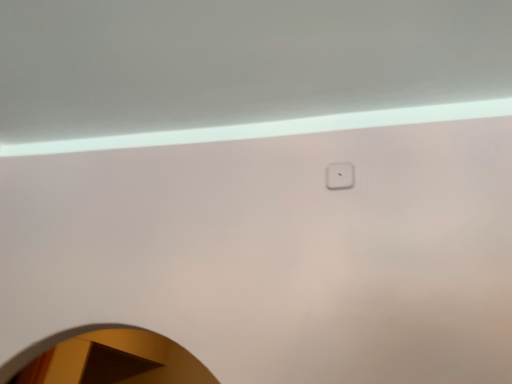
Question: From the image's perspective, is white glossy mirror at lower left located above or below white plastic light switch at upper center?

Choices:
 (A) below
 (B) above

Answer: (A)

Question: Considering the relative positions of white glossy mirror at lower left and white plastic light switch at upper center in the image provided, is white glossy mirror at lower left to the left or to the right of white plastic light switch at upper center?

Choices:
 (A) right
 (B) left

Answer: (B)

Question: Choose the correct answer: Is white glossy mirror at lower left inside white plastic light switch at upper center or outside it?

Choices:
 (A) inside
 (B) outside

Answer: (B)

Question: Is white plastic light switch at upper center wider or thinner than white glossy mirror at lower left?

Choices:
 (A) thin
 (B) wide

Answer: (A)

Question: Do you think white plastic light switch at upper center is within white glossy mirror at lower left, or outside of it?

Choices:
 (A) inside
 (B) outside

Answer: (B)

Question: Considering the positions of white plastic light switch at upper center and white glossy mirror at lower left in the image, is white plastic light switch at upper center bigger or smaller than white glossy mirror at lower left?

Choices:
 (A) big
 (B) small

Answer: (B)

Question: From the image's perspective, is white plastic light switch at upper center above or below white glossy mirror at lower left?

Choices:
 (A) below
 (B) above

Answer: (B)